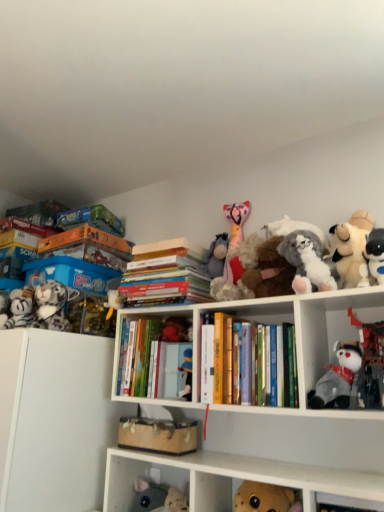
Question: Is fluffy gray plush at left, placed as the 9th toy when sorted from right to left, at the back of hardcover books at center, placed as the first book when sorted from left to right?

Choices:
 (A) no
 (B) yes

Answer: (A)

Question: Is the position of hardcover books at center, which ranks as the 3th book in right-to-left order, less distant than that of fluffy gray plush at left, placed as the 9th toy when sorted from right to left?

Choices:
 (A) no
 (B) yes

Answer: (A)

Question: From the image's perspective, does hardcover books at center, placed as the first book when sorted from left to right, appear higher than fluffy gray plush at left, the 2th toy in the left-to-right sequence?

Choices:
 (A) no
 (B) yes

Answer: (A)

Question: From the image's perspective, is hardcover books at center, placed as the first book when sorted from left to right, below fluffy gray plush at left, the 2th toy in the left-to-right sequence?

Choices:
 (A) yes
 (B) no

Answer: (A)

Question: Is hardcover books at center, which ranks as the 3th book in right-to-left order, bigger than fluffy gray plush at left, placed as the 9th toy when sorted from right to left?

Choices:
 (A) yes
 (B) no

Answer: (A)

Question: Can you confirm if hardcover books at center, placed as the first book when sorted from left to right, is wider than fluffy gray plush at left, the 2th toy in the left-to-right sequence?

Choices:
 (A) yes
 (B) no

Answer: (A)

Question: Would you say fluffy white plush at upper right, placed as the 5th toy when sorted from right to left, is outside fuzzy fabric stuffed animal at lower left, placed as the 2th cabinet when sorted from top to bottom?

Choices:
 (A) yes
 (B) no

Answer: (A)

Question: From a real-world perspective, is fluffy white plush at upper right, placed as the 5th toy when sorted from right to left, located beneath fuzzy fabric stuffed animal at lower left, placed as the 2th cabinet when sorted from top to bottom?

Choices:
 (A) no
 (B) yes

Answer: (A)

Question: Considering the relative sizes of fluffy white plush at upper right, placed as the 5th toy when sorted from right to left, and fuzzy fabric stuffed animal at lower left, the 1th cabinet from the bottom, in the image provided, is fluffy white plush at upper right, placed as the 5th toy when sorted from right to left, shorter than fuzzy fabric stuffed animal at lower left, the 1th cabinet from the bottom,?

Choices:
 (A) yes
 (B) no

Answer: (A)

Question: Considering the relative sizes of fluffy white plush at upper right, placed as the 5th toy when sorted from right to left, and fuzzy fabric stuffed animal at lower left, the 1th cabinet from the bottom, in the image provided, is fluffy white plush at upper right, placed as the 5th toy when sorted from right to left, wider than fuzzy fabric stuffed animal at lower left, the 1th cabinet from the bottom,?

Choices:
 (A) no
 (B) yes

Answer: (B)

Question: Can you confirm if fluffy white plush at upper right, the 6th toy in the left-to-right sequence, is smaller than fuzzy fabric stuffed animal at lower left, the 1th cabinet from the bottom?

Choices:
 (A) yes
 (B) no

Answer: (A)

Question: Is fluffy white plush at upper right, placed as the 5th toy when sorted from right to left, to the left of fuzzy fabric stuffed animal at lower left, the 1th cabinet from the bottom, from the viewer's perspective?

Choices:
 (A) yes
 (B) no

Answer: (B)

Question: Is the position of fluffy gray plush at left, the 2th toy in the left-to-right sequence, less distant than that of fluffy white stuffed animal at upper right, which is the 3th toy from right to left?

Choices:
 (A) yes
 (B) no

Answer: (B)